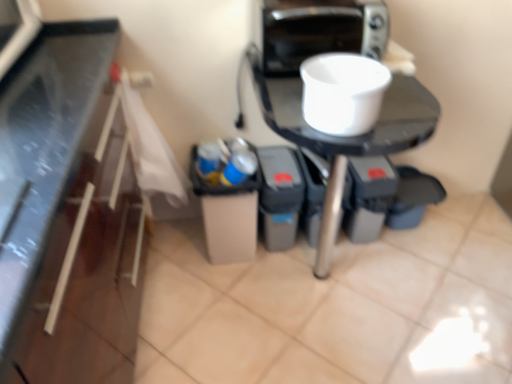
Question: Is white glossy table at center not close to blue plastic cup at center?

Choices:
 (A) no
 (B) yes

Answer: (A)

Question: From the image's perspective, is white glossy table at center on top of blue plastic cup at center?

Choices:
 (A) yes
 (B) no

Answer: (B)

Question: Is white glossy table at center at the right side of blue plastic cup at center?

Choices:
 (A) no
 (B) yes

Answer: (B)

Question: Is blue plastic cup at center a part of white glossy table at center?

Choices:
 (A) no
 (B) yes

Answer: (A)

Question: Considering the relative sizes of white glossy table at center and blue plastic cup at center in the image provided, is white glossy table at center smaller than blue plastic cup at center?

Choices:
 (A) no
 (B) yes

Answer: (A)

Question: Can you confirm if white glossy table at center is bigger than blue plastic cup at center?

Choices:
 (A) no
 (B) yes

Answer: (B)

Question: Is metallic silver toaster at upper right oriented towards white matte bowl at upper center?

Choices:
 (A) yes
 (B) no

Answer: (A)

Question: Can you confirm if metallic silver toaster at upper right is positioned to the left of white matte bowl at upper center?

Choices:
 (A) yes
 (B) no

Answer: (A)

Question: From a real-world perspective, is metallic silver toaster at upper right located higher than white matte bowl at upper center?

Choices:
 (A) yes
 (B) no

Answer: (A)

Question: Can you confirm if metallic silver toaster at upper right is taller than white matte bowl at upper center?

Choices:
 (A) no
 (B) yes

Answer: (B)

Question: Is metallic silver toaster at upper right not close to white matte bowl at upper center?

Choices:
 (A) yes
 (B) no

Answer: (B)

Question: From a real-world perspective, is metallic silver toaster at upper right positioned under white matte bowl at upper center based on gravity?

Choices:
 (A) yes
 (B) no

Answer: (B)

Question: Can you confirm if blue plastic cup at center is positioned to the right of metallic silver toaster at upper right?

Choices:
 (A) no
 (B) yes

Answer: (A)